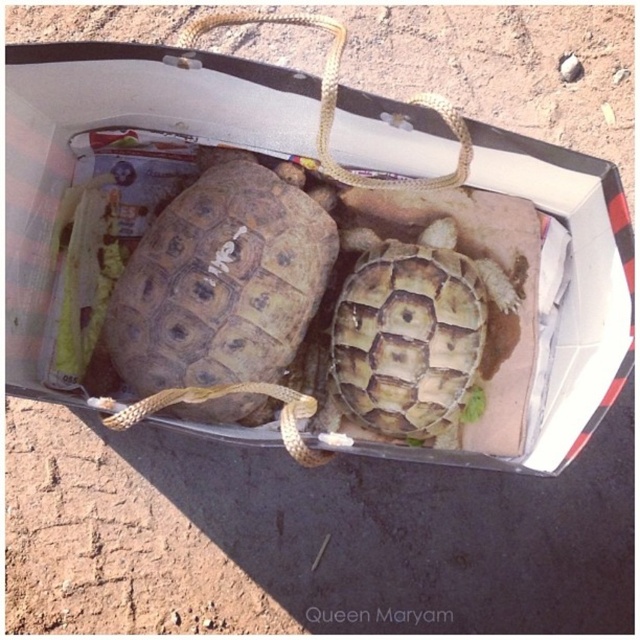
Question: Which of the following is the closest to the observer?

Choices:
 (A) [467, 392]
 (B) [180, 310]
 (C) [280, 77]

Answer: (C)

Question: Is matte cardboard box at center to the left of rusty metal tortoise at center from the viewer's perspective?

Choices:
 (A) yes
 (B) no

Answer: (A)

Question: Does matte cardboard box at center have a lesser width compared to rusty metal tortoise at center?

Choices:
 (A) no
 (B) yes

Answer: (A)

Question: Can you confirm if matte cardboard box at center is positioned to the left of rusty metal tortoise at center?

Choices:
 (A) yes
 (B) no

Answer: (A)

Question: Which point is closer to the camera taking this photo?

Choices:
 (A) (467, 346)
 (B) (212, 408)
 (C) (214, 136)

Answer: (B)

Question: Which of the following is the farthest from the observer?

Choices:
 (A) matte cardboard box at center
 (B) brown textured tortoise at center

Answer: (B)